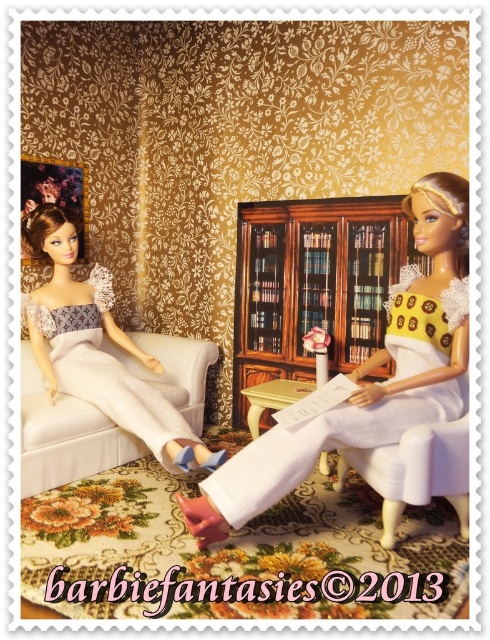
Question: Is yellow matte dress at center thinner than woodenmaterial/texturebookshelf at center?

Choices:
 (A) no
 (B) yes

Answer: (A)

Question: Estimate the real-world distances between objects in this image. Which object is farther from the white satin dress at left?

Choices:
 (A) yellow matte dress at center
 (B) woodenmaterial/texturebookshelf at center

Answer: (A)

Question: Observing the image, what is the correct spatial positioning of woodenmaterial/texturebookshelf at center in reference to white satin dress at left?

Choices:
 (A) above
 (B) below

Answer: (A)

Question: Is yellow matte dress at center closer to the viewer compared to woodenmaterial/texturebookshelf at center?

Choices:
 (A) yes
 (B) no

Answer: (A)

Question: Among these objects, which one is nearest to the camera?

Choices:
 (A) woodenmaterial/texturebookshelf at center
 (B) white satin dress at left
 (C) yellow matte dress at center

Answer: (C)

Question: Which point appears farthest from the camera in this image?

Choices:
 (A) (74, 340)
 (B) (384, 330)

Answer: (A)